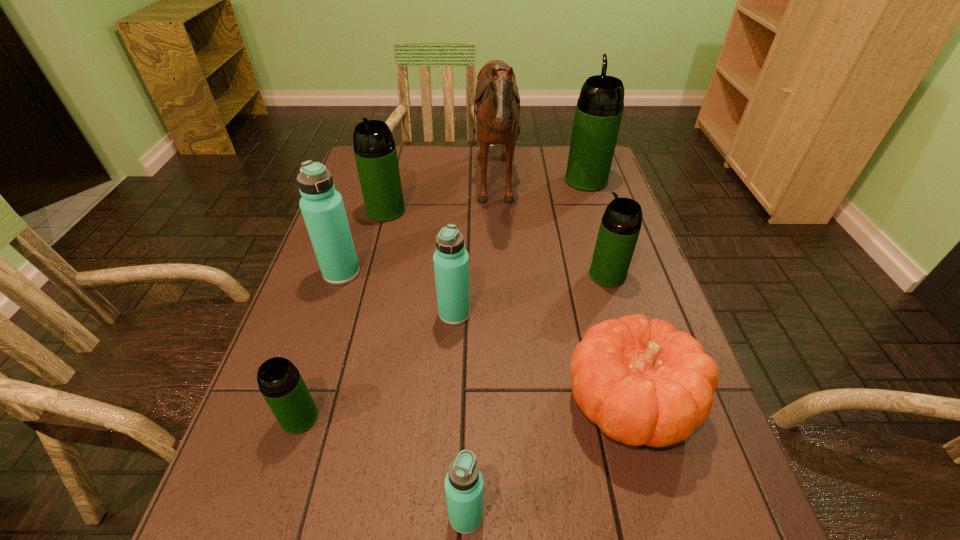
At what (x,y) coordinates should I click in order to perform the action: click on saddle. Please return your answer as a coordinate pair (x, y). Image resolution: width=960 pixels, height=540 pixels. Looking at the image, I should click on (497, 102).

Where is `the tallest object`? The height and width of the screenshot is (540, 960). the tallest object is located at coordinates (497, 102).

Where is `the farthest green thermos bottle`? The image size is (960, 540). the farthest green thermos bottle is located at coordinates (599, 109).

This screenshot has width=960, height=540. Identify the location of the biggest green thermos bottle. (599, 109).

Locate an element on the screen. Image resolution: width=960 pixels, height=540 pixels. the second farthest thermos bottle is located at coordinates (375, 152).

At what (x,y) coordinates should I click in order to perform the action: click on the third nearest green thermos bottle. Please return your answer as a coordinate pair (x, y). The image size is (960, 540). Looking at the image, I should click on (375, 152).

The image size is (960, 540). What are the coordinates of `the leftmost aqua thermos bottle` in the screenshot? It's located at (322, 207).

Identify the location of the biggest aqua thermos bottle. (322, 207).

The width and height of the screenshot is (960, 540). In order to click on the sixth farthest object in this screenshot , I will do `click(451, 260)`.

Identify the location of the second smallest aqua thermos bottle. (451, 260).